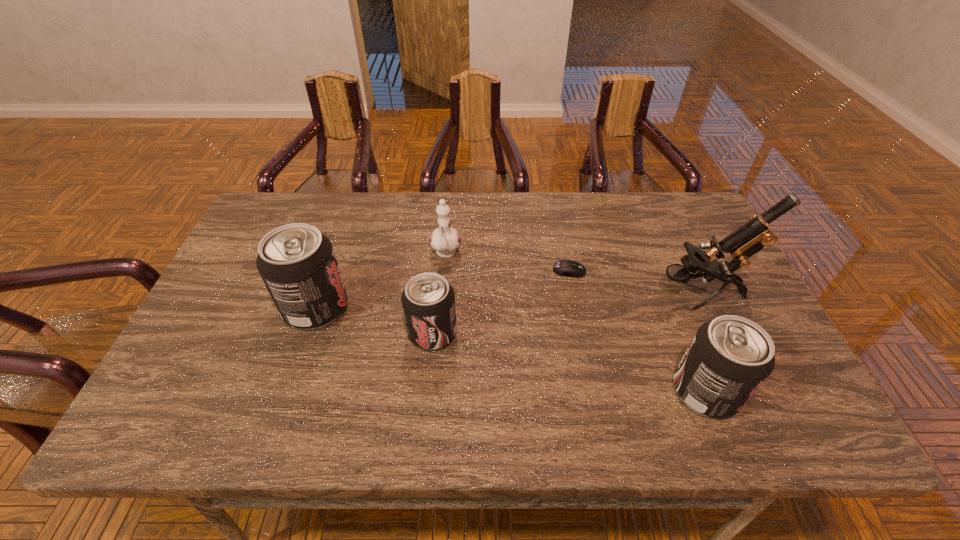
At what (x,y) coordinates should I click in order to perform the action: click on vacant area at the far edge of the desktop. Please return your answer as a coordinate pair (x, y). Looking at the image, I should click on coord(364,215).

Identify the location of vacant space at the near edge of the desktop. The image size is (960, 540). (457, 378).

Find the location of a particular element. The width and height of the screenshot is (960, 540). free space at the left edge is located at coordinates (244, 275).

Locate an element on the screen. vacant region at the right edge of the desktop is located at coordinates (674, 252).

In the image, there is a desktop. Where is `free space at the far left corner`? The width and height of the screenshot is (960, 540). free space at the far left corner is located at coordinates (267, 220).

Identify the location of free spot at the far right corner of the desktop. (658, 211).

I want to click on vacant region between the nearest object and the computer equipment, so click(x=637, y=331).

Find the location of a particular element. blank region between the chinaware and the computer equipment is located at coordinates (508, 262).

Locate an element on the screen. This screenshot has width=960, height=540. free space between the shortest soda can and the leftmost object is located at coordinates (374, 320).

Where is `vacant space in between the second soda can from left to right and the microscope`? This screenshot has width=960, height=540. vacant space in between the second soda can from left to right and the microscope is located at coordinates (566, 313).